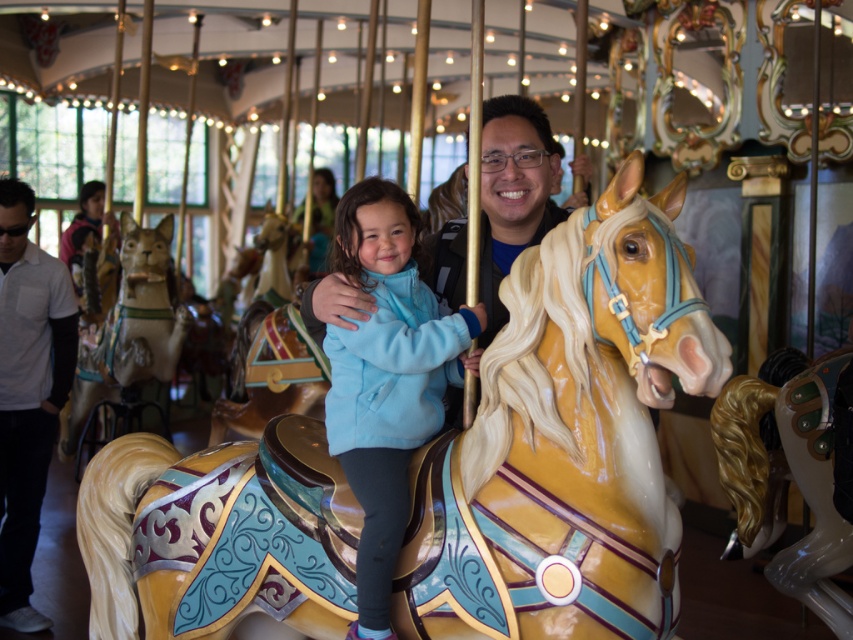
Question: Can you confirm if light blue fleece jacket at center is smaller than wooden horse at center?

Choices:
 (A) no
 (B) yes

Answer: (A)

Question: Which point appears closest to the camera in this image?

Choices:
 (A) (328, 340)
 (B) (62, 380)
 (C) (759, 541)

Answer: (A)

Question: Observing the image, what is the correct spatial positioning of white matte shirt at left in reference to shiny gold mane at center?

Choices:
 (A) right
 (B) left

Answer: (B)

Question: Which point is closer to the camera?

Choices:
 (A) white matte shirt at left
 (B) wooden horse at center
 (C) shiny gold mane at center

Answer: (C)

Question: Is shiny gold mane at center smaller than wooden horse at center?

Choices:
 (A) yes
 (B) no

Answer: (B)

Question: Which object is the closest to the shiny gold mane at center?

Choices:
 (A) wooden horse at center
 (B) shiny gold horse at center

Answer: (B)